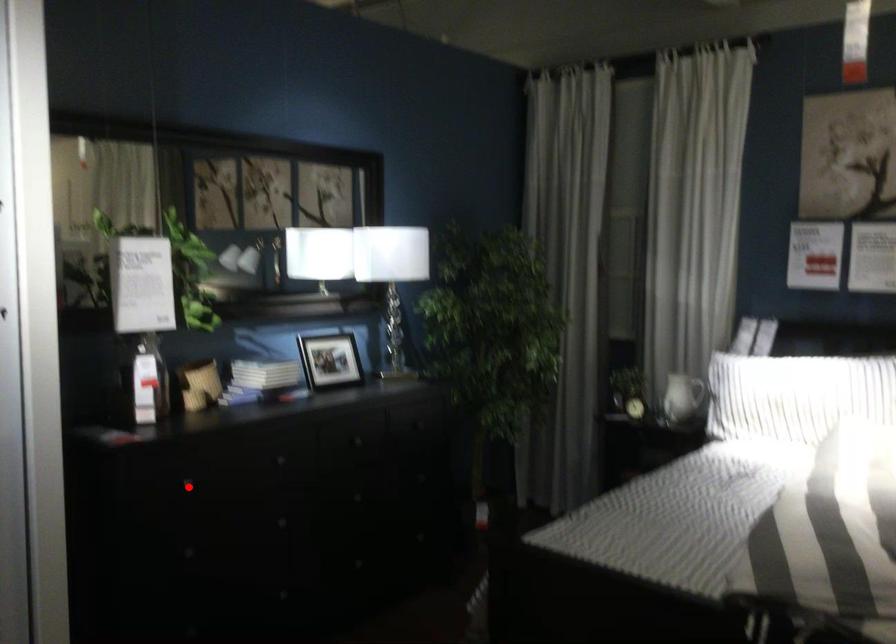
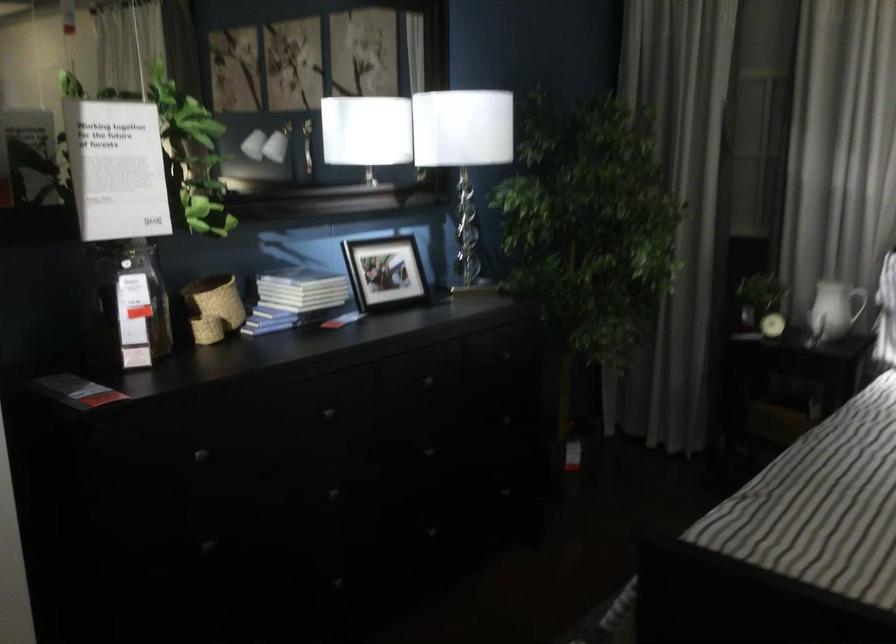
Question: I am providing you with two images of the same scene from different viewpoints. A red point is shown in image1. For the corresponding object point in image2, is it positioned nearer or farther from the camera?

Choices:
 (A) Nearer
 (B) Farther

Answer: (A)